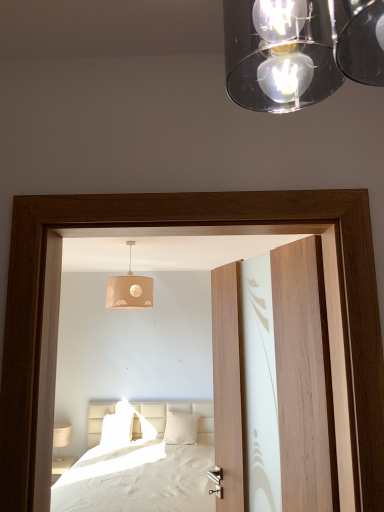
Question: From the image's perspective, does white textured pillow at center, positioned as the first pillow in right-to-left order, appear lower than wooden door at center?

Choices:
 (A) no
 (B) yes

Answer: (B)

Question: Does white textured pillow at center, positioned as the first pillow in right-to-left order, have a smaller size compared to wooden door at center?

Choices:
 (A) yes
 (B) no

Answer: (A)

Question: From a real-world perspective, is white textured pillow at center, positioned as the first pillow in right-to-left order, on top of wooden door at center?

Choices:
 (A) yes
 (B) no

Answer: (B)

Question: Considering the relative positions of white textured pillow at center, which is the 2th pillow from left to right, and wooden door at center in the image provided, is white textured pillow at center, which is the 2th pillow from left to right, to the right of wooden door at center from the viewer's perspective?

Choices:
 (A) yes
 (B) no

Answer: (B)

Question: Is white textured pillow at center, which is the 2th pillow from left to right, positioned before wooden door at center?

Choices:
 (A) yes
 (B) no

Answer: (B)

Question: From a real-world perspective, is white matte pillow at center, positioned as the 1th pillow in left-to-right order, above or below beige fabric lampshade at center?

Choices:
 (A) above
 (B) below

Answer: (B)

Question: Considering the positions of point (104, 425) and point (125, 303), is point (104, 425) closer or farther from the camera than point (125, 303)?

Choices:
 (A) closer
 (B) farther

Answer: (B)

Question: Would you say white matte pillow at center, the 2th pillow from the right, is to the left or to the right of beige fabric lampshade at center in the picture?

Choices:
 (A) right
 (B) left

Answer: (B)

Question: Choose the correct answer: Is white matte pillow at center, the 2th pillow from the right, inside beige fabric lampshade at center or outside it?

Choices:
 (A) outside
 (B) inside

Answer: (A)

Question: Considering the positions of white fabric table lamp at lower left and transparent glass door at center in the image, is white fabric table lamp at lower left taller or shorter than transparent glass door at center?

Choices:
 (A) tall
 (B) short

Answer: (B)

Question: Is point (69, 438) closer or farther from the camera than point (322, 446)?

Choices:
 (A) closer
 (B) farther

Answer: (B)

Question: From the image's perspective, is white fabric table lamp at lower left positioned above or below transparent glass door at center?

Choices:
 (A) below
 (B) above

Answer: (A)

Question: From a real-world perspective, is white fabric table lamp at lower left positioned above or below transparent glass door at center?

Choices:
 (A) below
 (B) above

Answer: (A)

Question: Considering their positions, is white quilted bed at center located in front of or behind beige fabric lampshade at center?

Choices:
 (A) behind
 (B) front

Answer: (B)

Question: Is white quilted bed at center taller or shorter than beige fabric lampshade at center?

Choices:
 (A) tall
 (B) short

Answer: (A)